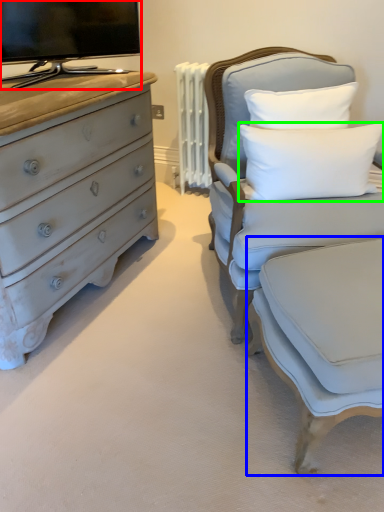
Question: Which is nearer to the television (highlighted by a red box)? swivel chair (highlighted by a blue box) or pillow (highlighted by a green box).

Choices:
 (A) swivel chair
 (B) pillow

Answer: (B)